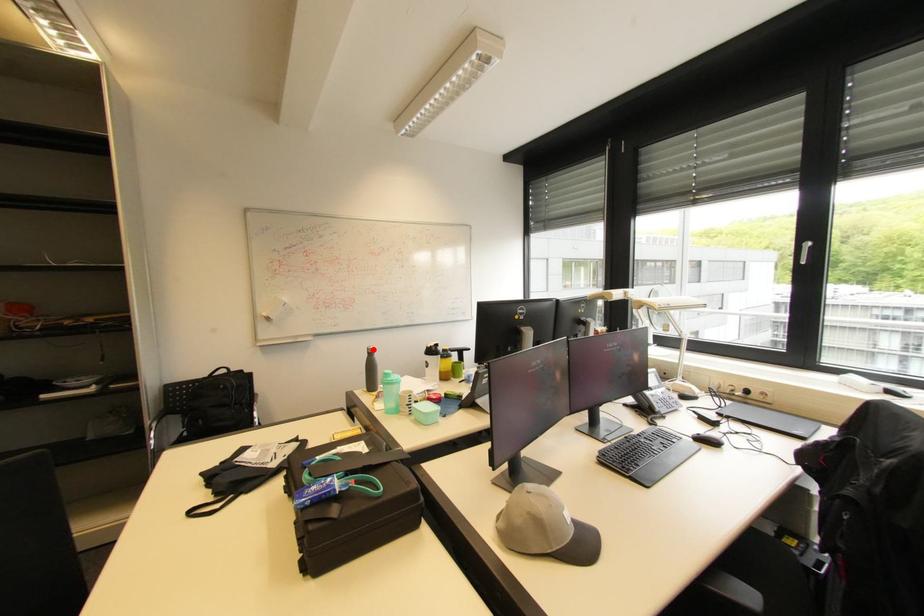
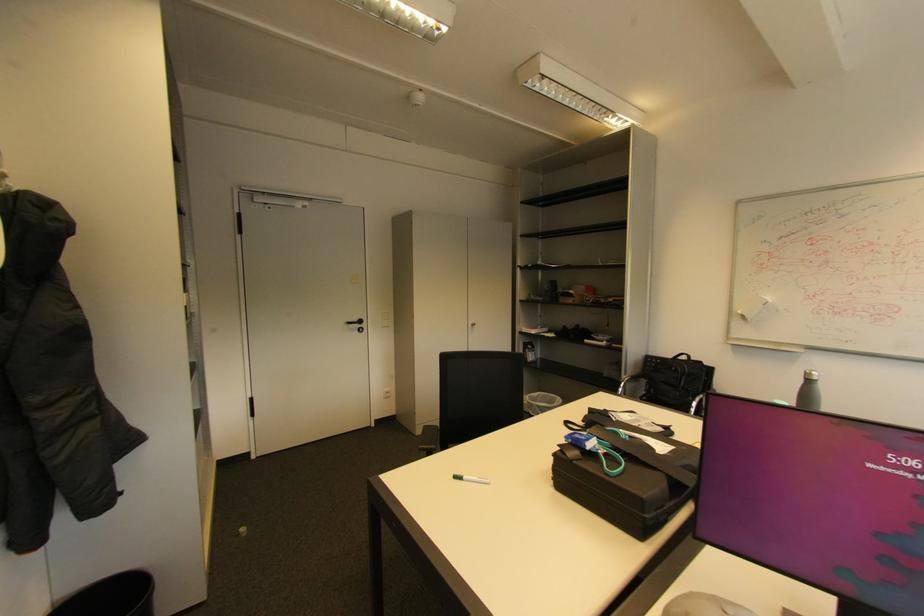
The point at the highlighted location is marked in the first image. Where is the corresponding point in the second image?

(811, 373)